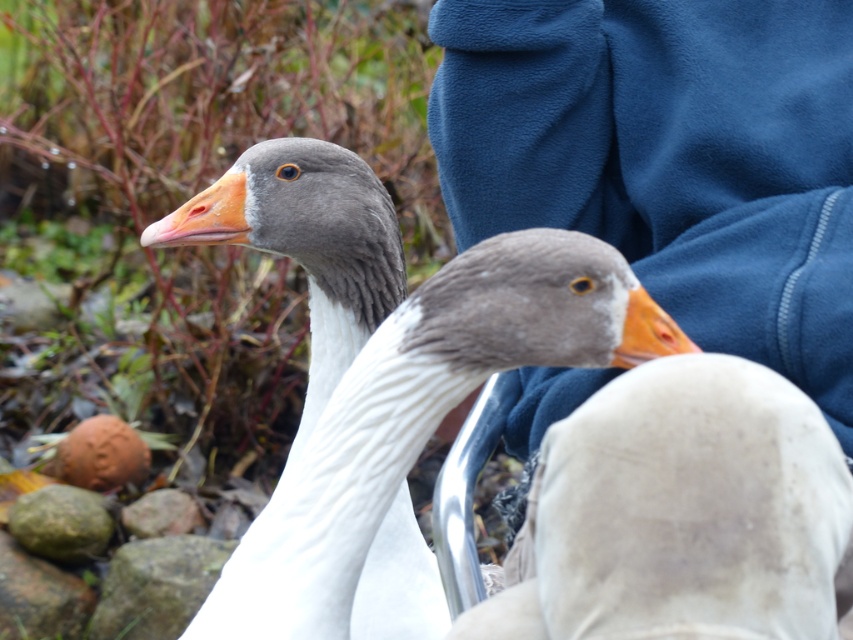
Does smooth gray rock at lower left have a lesser height compared to brown clay stone at lower left?

In fact, smooth gray rock at lower left may be taller than brown clay stone at lower left.

Is smooth gray rock at lower left to the left of brown clay stone at lower left from the viewer's perspective?

Incorrect, smooth gray rock at lower left is not on the left side of brown clay stone at lower left.

Is point (120, 570) farther from camera compared to point (97, 445)?

No, it is in front of (97, 445).

In order to click on smooth gray rock at lower left in this screenshot , I will do `click(155, 586)`.

Does green rough stone at lower left appear under brown clay stone at lower left?

Correct, green rough stone at lower left is located below brown clay stone at lower left.

Who is more forward, (x=59, y=516) or (x=102, y=435)?

Point (x=59, y=516) is more forward.

Who is more distant from viewer, (62, 531) or (86, 419)?

Point (86, 419)

The image size is (853, 640). I want to click on green rough stone at lower left, so click(61, 522).

What do you see at coordinates (679, 513) in the screenshot? I see `white matte goose at center` at bounding box center [679, 513].

Does white matte goose at center have a greater height compared to gray rough rock at lower left?

No, white matte goose at center is not taller than gray rough rock at lower left.

Measure the distance between point (618,449) and camera.

Point (618,449) and camera are 28.62 inches apart from each other.

Identify the location of white matte goose at center. The image size is (853, 640). (679, 513).